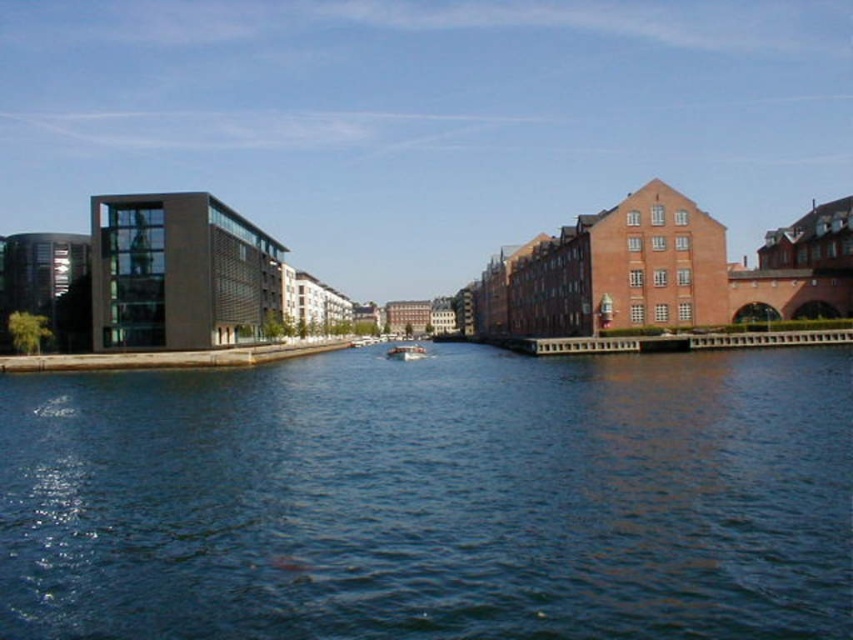
In the scene shown: Is dark blue water at center thinner than white plastic boat at center?

In fact, dark blue water at center might be wider than white plastic boat at center.

Between point (735, 525) and point (393, 355), which one is positioned in front?

Point (735, 525) is more forward.

Identify the location of dark blue water at center. (432, 499).